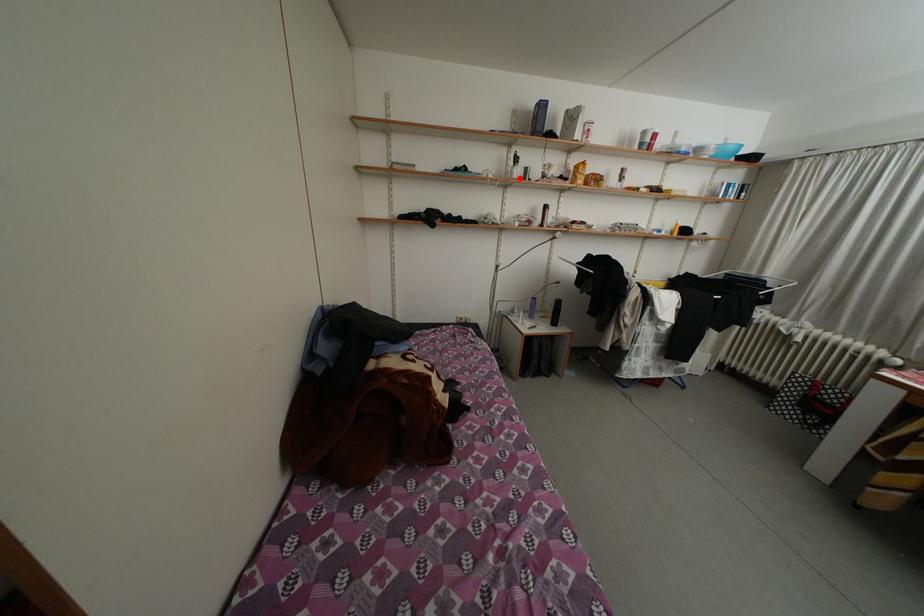
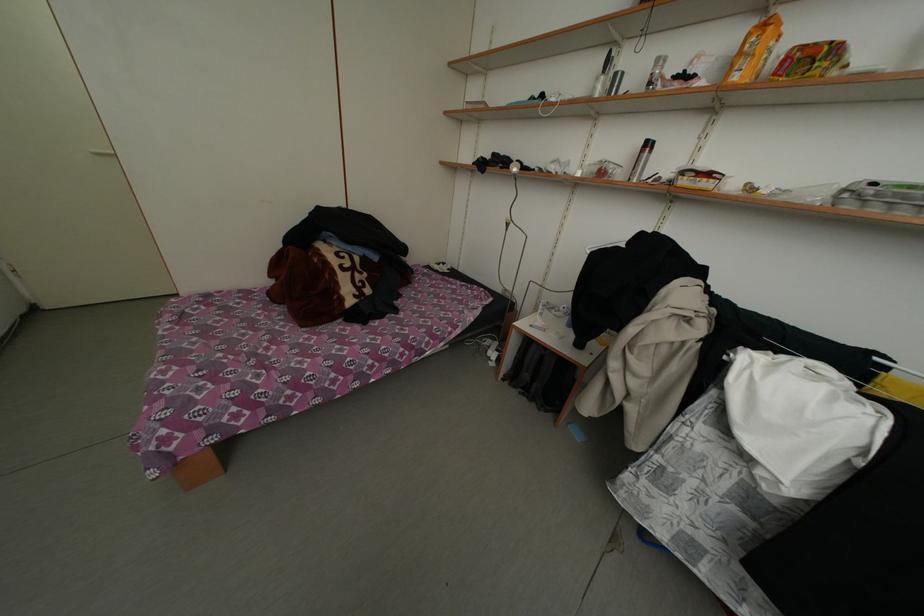
The point at the highlighted location is marked in the first image. Where is the corresponding point in the second image?

(602, 94)